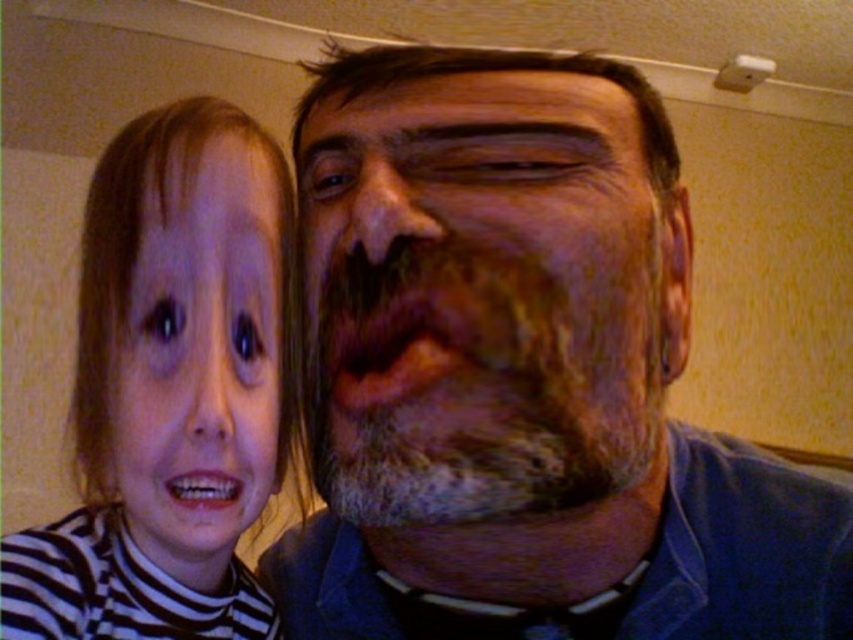
Question: Where is striped turtleneck at left located in relation to smooth skin face at left in the image?

Choices:
 (A) above
 (B) below

Answer: (B)

Question: Estimate the real-world distances between objects in this image. Which object is farther from the gray beard at left?

Choices:
 (A) grayish-brown beard at center
 (B) striped turtleneck at left
 (C) smooth skin face at left

Answer: (C)

Question: Which point appears closest to the camera in this image?

Choices:
 (A) (84, 609)
 (B) (315, 369)

Answer: (B)

Question: Is grayish-brown beard at center thinner than smooth skin face at left?

Choices:
 (A) yes
 (B) no

Answer: (B)

Question: Considering the relative positions of grayish-brown beard at center and striped turtleneck at left in the image provided, where is grayish-brown beard at center located with respect to striped turtleneck at left?

Choices:
 (A) right
 (B) left

Answer: (A)

Question: Which of these objects is positioned closest to the striped turtleneck at left?

Choices:
 (A) smooth skin face at left
 (B) gray beard at left

Answer: (A)